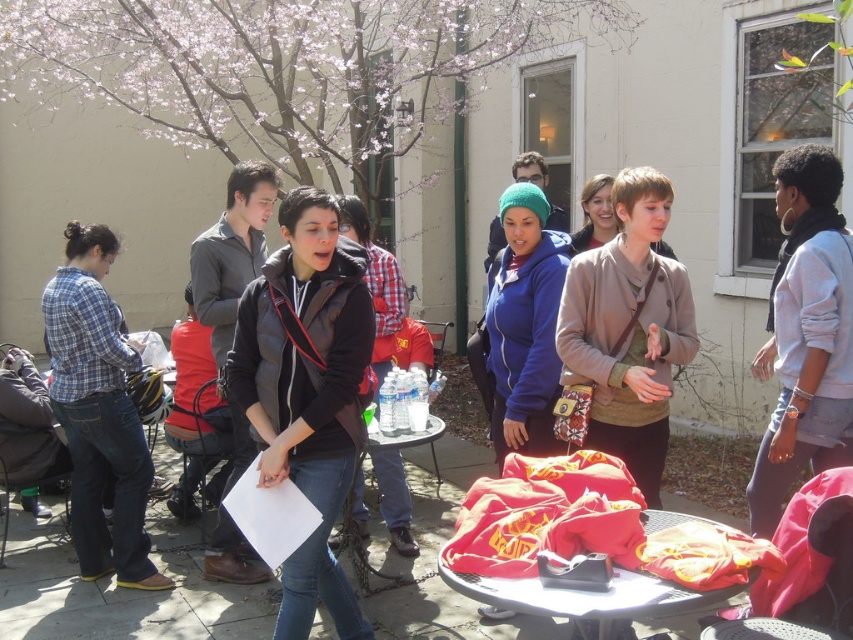
Is light blue denim jacket at upper right to the right of red fabric table at center from the viewer's perspective?

Yes, light blue denim jacket at upper right is to the right of red fabric table at center.

Between light blue denim jacket at upper right and red fabric table at center, which one appears on the left side from the viewer's perspective?

From the viewer's perspective, red fabric table at center appears more on the left side.

In order to click on light blue denim jacket at upper right in this screenshot , I will do `click(805, 333)`.

Is point (618, 452) positioned after point (808, 300)?

That is True.

Does matte brown jacket at center appear under light blue denim jacket at upper right?

Correct, matte brown jacket at center is located below light blue denim jacket at upper right.

The image size is (853, 640). Identify the location of matte brown jacket at center. (628, 330).

Locate an element on the screen. The width and height of the screenshot is (853, 640). matte brown jacket at center is located at coordinates (628, 330).

How far apart are black matte vest at center and plaid cotton shirt at left?

The distance of black matte vest at center from plaid cotton shirt at left is 4.74 feet.

Is black matte vest at center to the right of plaid cotton shirt at left from the viewer's perspective?

Correct, you'll find black matte vest at center to the right of plaid cotton shirt at left.

Locate an element on the screen. The height and width of the screenshot is (640, 853). black matte vest at center is located at coordinates (306, 392).